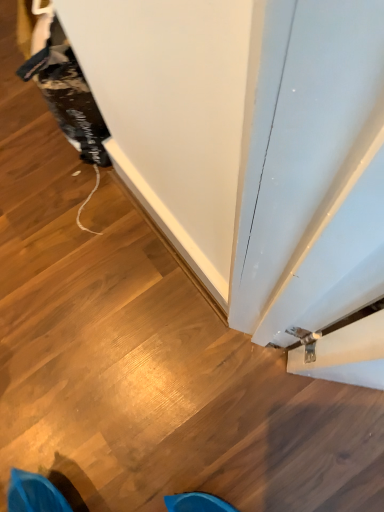
Describe the element at coordinates (68, 95) in the screenshot. I see `black textured fabric at left` at that location.

Measure the distance between black textured fabric at left and camera.

26.06 inches.

Image resolution: width=384 pixels, height=512 pixels. In order to click on black textured fabric at left in this screenshot , I will do `click(68, 95)`.

Measure the distance between point (48, 50) and camera.

Point (48, 50) is 26.73 inches away from camera.

What is the approximate height of black textured fabric at left?

19.39 inches.

This screenshot has width=384, height=512. I want to click on black textured fabric at left, so click(68, 95).